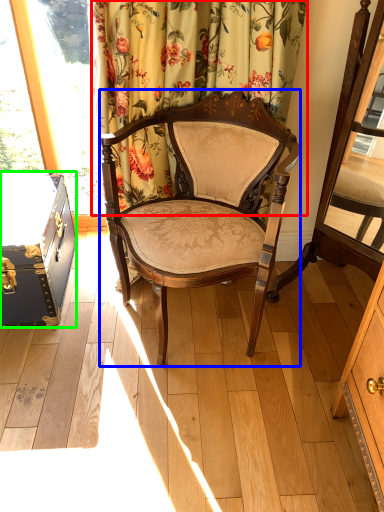
Question: Considering the real-world distances, which object is farthest from curtain (highlighted by a red box)? chair (highlighted by a blue box) or box (highlighted by a green box)?

Choices:
 (A) chair
 (B) box

Answer: (B)